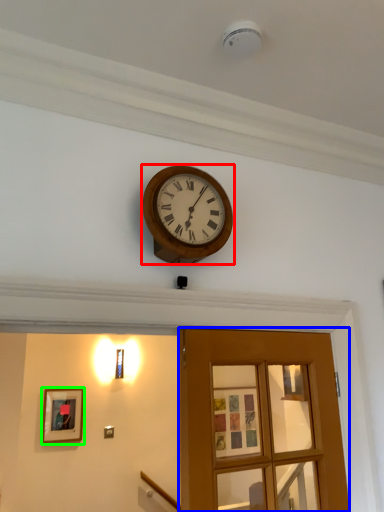
Question: Which object is positioned closest to wall clock (highlighted by a red box)? Select from door (highlighted by a blue box) and picture frame (highlighted by a green box).

Choices:
 (A) door
 (B) picture frame

Answer: (A)